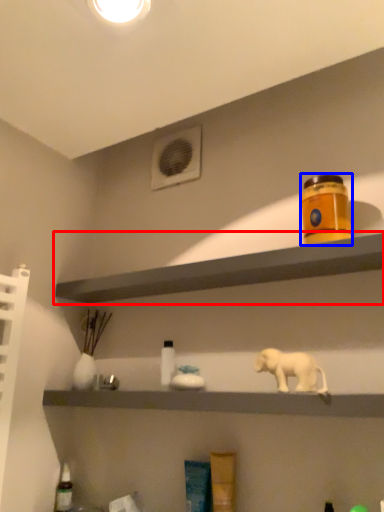
Question: Which object appears closest to the camera in this image, shelf (highlighted by a red box) or product (highlighted by a blue box)?

Choices:
 (A) shelf
 (B) product

Answer: (A)